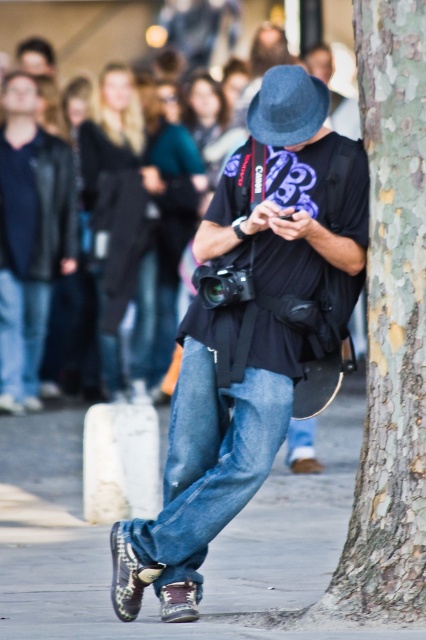
Question: Estimate the real-world distances between objects in this image. Which object is closer to the matte black t-shirt at center?

Choices:
 (A) denim jeans at center
 (B) denim jeans at lower left
 (C) felt gray hat at center
 (D) denim jeans at lower center

Answer: (D)

Question: Does matte black t-shirt at center have a larger size compared to matte black jacket at upper left?

Choices:
 (A) no
 (B) yes

Answer: (B)

Question: Which point appears closest to the camera in this image?

Choices:
 (A) (218, 397)
 (B) (287, 356)

Answer: (B)

Question: Is matte black t-shirt at center thinner than denim jeans at lower left?

Choices:
 (A) no
 (B) yes

Answer: (A)

Question: Which point is closer to the camera taking this photo?

Choices:
 (A) (244, 493)
 (B) (0, 12)
 (C) (382, 630)

Answer: (C)

Question: Can you confirm if denim jeans at lower center is bigger than denim jeans at center?

Choices:
 (A) no
 (B) yes

Answer: (A)